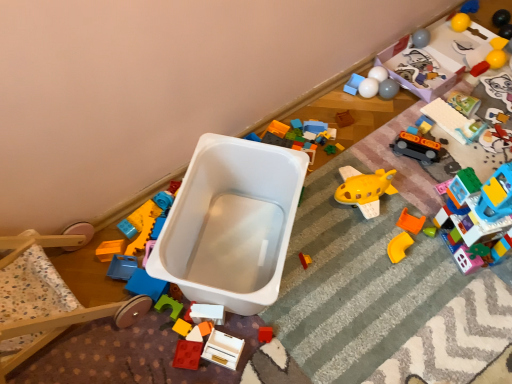
Locate an element on the screen. The image size is (512, 384). vacant space positioned to the left of orange plastic train at center, the eleventh toy positioned from the left is located at coordinates (376, 158).